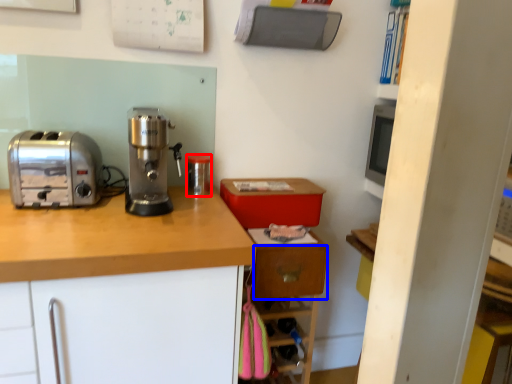
Question: Which object appears farthest to the camera in this image, kitchen appliance (highlighted by a red box) or drawer (highlighted by a blue box)?

Choices:
 (A) kitchen appliance
 (B) drawer

Answer: (A)